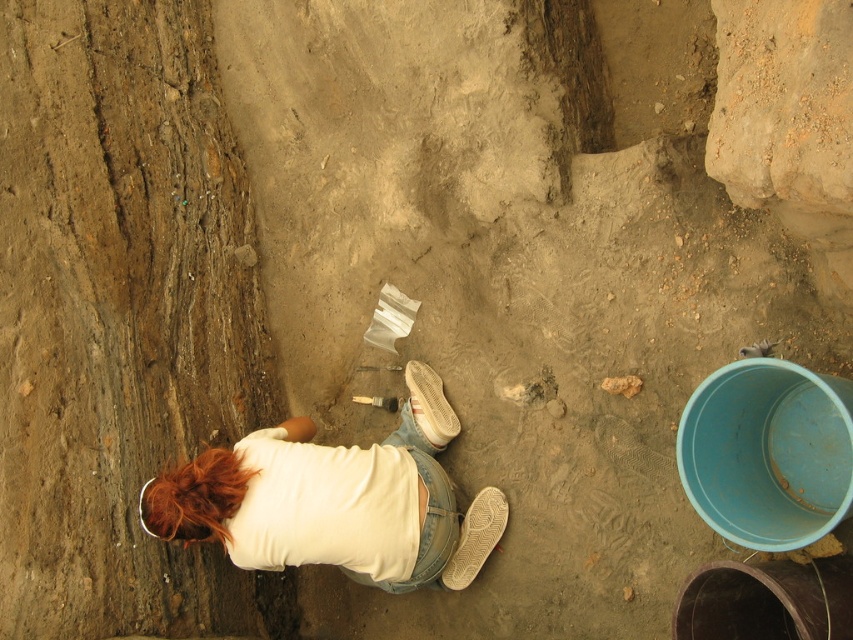
Question: Is white matte shoe at lower center positioned at the back of white suede shoe at center?

Choices:
 (A) yes
 (B) no

Answer: (B)

Question: Can you confirm if white cotton shirt at center is positioned below white suede shoe at center?

Choices:
 (A) no
 (B) yes

Answer: (B)

Question: Which point is closer to the camera taking this photo?

Choices:
 (A) (490, 484)
 (B) (425, 368)

Answer: (A)

Question: Among these objects, which one is nearest to the camera?

Choices:
 (A) white suede shoe at center
 (B) white cotton shirt at center
 (C) white matte shoe at lower center

Answer: (B)

Question: Does white cotton shirt at center lie in front of white suede shoe at center?

Choices:
 (A) no
 (B) yes

Answer: (B)

Question: Which object is the closest to the white suede shoe at center?

Choices:
 (A) white matte shoe at lower center
 (B) white cotton shirt at center

Answer: (B)